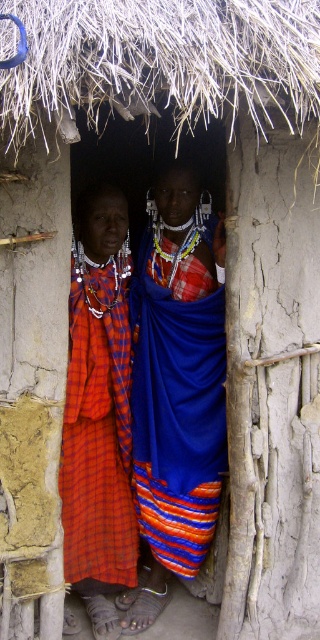
Question: Which of the following is the closest to the observer?

Choices:
 (A) (126, 323)
 (B) (193, 237)

Answer: (A)

Question: Can you confirm if blue woven cloth at center is positioned above plaid fabric skirt at left?

Choices:
 (A) yes
 (B) no

Answer: (A)

Question: Can you confirm if blue woven cloth at center is positioned to the right of plaid fabric skirt at left?

Choices:
 (A) yes
 (B) no

Answer: (A)

Question: Is blue woven cloth at center smaller than plaid fabric skirt at left?

Choices:
 (A) no
 (B) yes

Answer: (A)

Question: Which point is closer to the camera?

Choices:
 (A) (115, 566)
 (B) (167, 573)

Answer: (A)